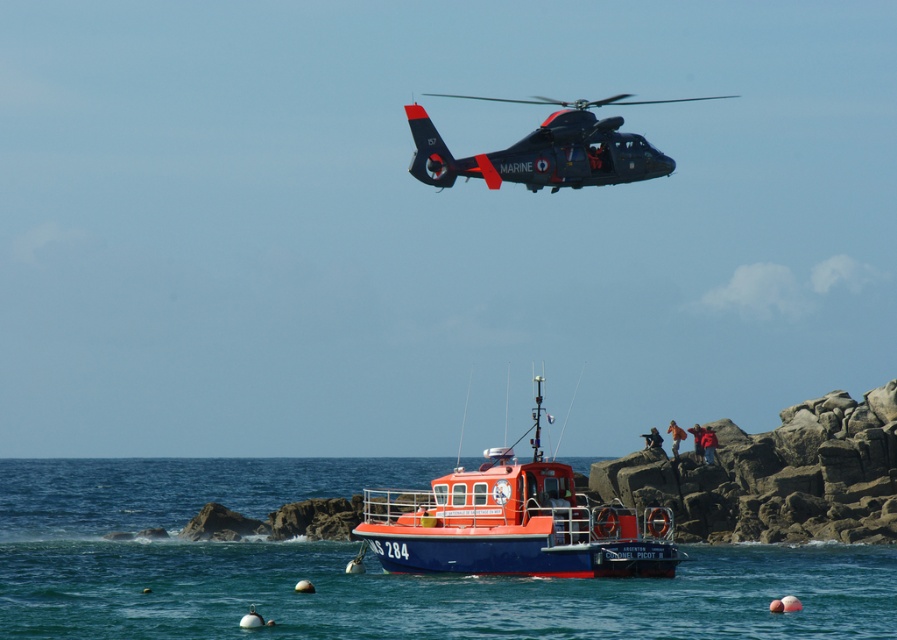
Question: Which of the following is the closest to the observer?

Choices:
 (A) blue water at boat center
 (B) matte black helicopter at upper center
 (C) orange glossy boat at center

Answer: (A)

Question: Which point appears farthest from the camera in this image?

Choices:
 (A) (568, 156)
 (B) (504, 609)
 (C) (397, 554)

Answer: (A)

Question: Does blue water at boat center appear on the left side of orange glossy boat at center?

Choices:
 (A) no
 (B) yes

Answer: (B)

Question: Estimate the real-world distances between objects in this image. Which object is closer to the matte black helicopter at upper center?

Choices:
 (A) orange glossy boat at center
 (B) blue water at boat center

Answer: (A)

Question: Does blue water at boat center have a greater width compared to orange glossy boat at center?

Choices:
 (A) yes
 (B) no

Answer: (A)

Question: Observing the image, what is the correct spatial positioning of blue water at boat center in reference to matte black helicopter at upper center?

Choices:
 (A) above
 (B) below

Answer: (B)